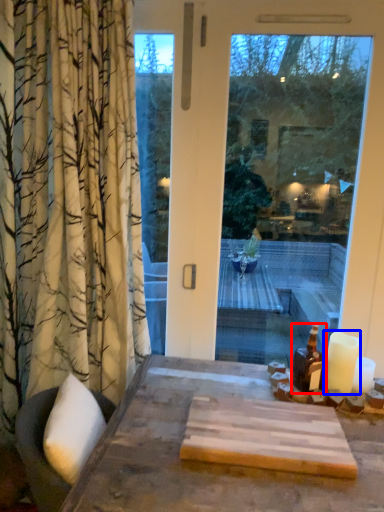
Question: Which object appears closest to the camera in this image, bottle (highlighted by a red box) or candle (highlighted by a blue box)?

Choices:
 (A) bottle
 (B) candle

Answer: (B)